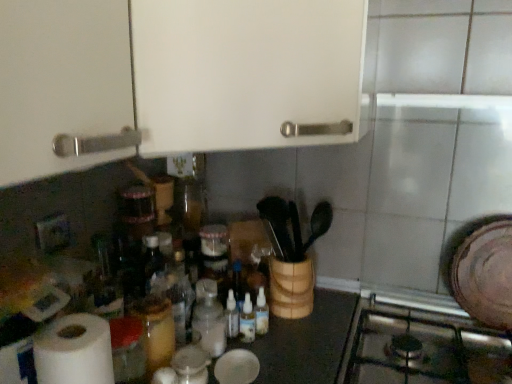
Question: From a real-world perspective, is white matte cabinet at upper center located beneath stainless steel gas stove at lower right?

Choices:
 (A) yes
 (B) no

Answer: (B)

Question: Is white matte cabinet at upper center thinner than stainless steel gas stove at lower right?

Choices:
 (A) yes
 (B) no

Answer: (B)

Question: From the image's perspective, is white matte cabinet at upper center below stainless steel gas stove at lower right?

Choices:
 (A) no
 (B) yes

Answer: (A)

Question: Is white matte cabinet at upper center aimed at stainless steel gas stove at lower right?

Choices:
 (A) no
 (B) yes

Answer: (A)

Question: Can you confirm if white matte cabinet at upper center is positioned to the right of stainless steel gas stove at lower right?

Choices:
 (A) no
 (B) yes

Answer: (A)

Question: Does white matte cabinet at upper center come behind stainless steel gas stove at lower right?

Choices:
 (A) no
 (B) yes

Answer: (A)

Question: Is translucent plastic bottles at center, arranged as the first bottle when viewed from the right, oriented towards white matte paper towel at lower left?

Choices:
 (A) no
 (B) yes

Answer: (A)

Question: Does translucent plastic bottles at center, which ranks as the 4th bottle in left-to-right order, have a greater height compared to white matte paper towel at lower left?

Choices:
 (A) no
 (B) yes

Answer: (A)

Question: From a real-world perspective, is translucent plastic bottles at center, which ranks as the 4th bottle in left-to-right order, under white matte paper towel at lower left?

Choices:
 (A) yes
 (B) no

Answer: (A)

Question: Is translucent plastic bottles at center, arranged as the first bottle when viewed from the right, wider than white matte paper towel at lower left?

Choices:
 (A) yes
 (B) no

Answer: (B)

Question: Does translucent plastic bottles at center, which ranks as the 4th bottle in left-to-right order, appear on the right side of white matte paper towel at lower left?

Choices:
 (A) yes
 (B) no

Answer: (A)

Question: Considering the relative sizes of translucent plastic bottles at center, which ranks as the 4th bottle in left-to-right order, and white matte paper towel at lower left in the image provided, is translucent plastic bottles at center, which ranks as the 4th bottle in left-to-right order, bigger than white matte paper towel at lower left?

Choices:
 (A) no
 (B) yes

Answer: (A)

Question: Is translucent plastic bottles at center, arranged as the first bottle when viewed from the right, looking in the opposite direction of translucent glass jar at center, arranged as the 1th bottle when viewed from the left?

Choices:
 (A) no
 (B) yes

Answer: (A)